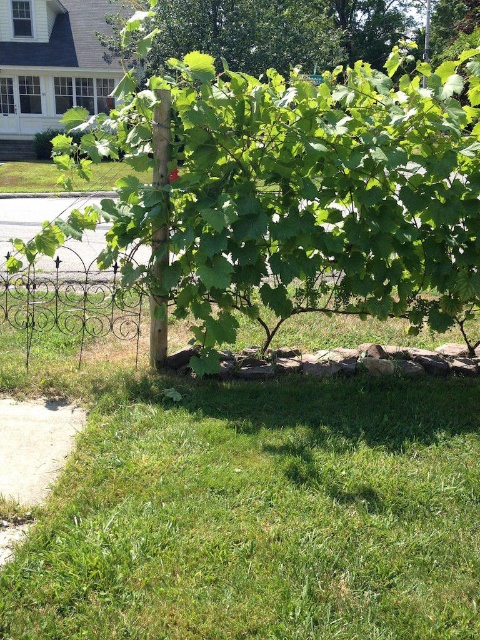
Question: Is green grass at lower left wider than green leafy tree at center?

Choices:
 (A) no
 (B) yes

Answer: (A)

Question: Is green grass at lower left wider than green leafy tree at center?

Choices:
 (A) yes
 (B) no

Answer: (B)

Question: Is green grass at lower left thinner than green leafy tree at center?

Choices:
 (A) yes
 (B) no

Answer: (A)